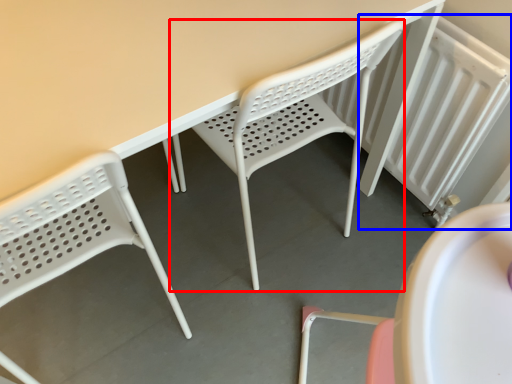
Question: Which point is further to the camera, chair (highlighted by a red box) or radiator (highlighted by a blue box)?

Choices:
 (A) chair
 (B) radiator

Answer: (B)